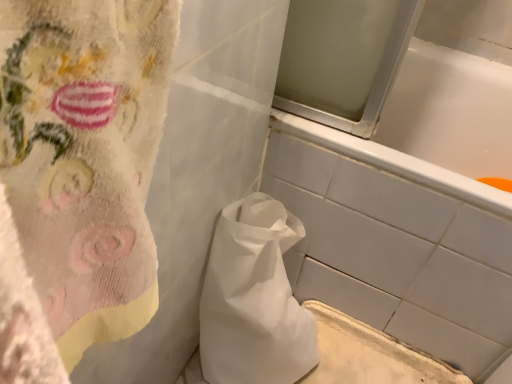
Question: Is white paper bag at center taller than white matte bathtub at center?

Choices:
 (A) yes
 (B) no

Answer: (B)

Question: Can you confirm if white paper bag at center is thinner than white matte bathtub at center?

Choices:
 (A) no
 (B) yes

Answer: (B)

Question: Would you say white matte bathtub at center is part of white paper bag at center's contents?

Choices:
 (A) yes
 (B) no

Answer: (B)

Question: Could you tell me if white paper bag at center is turned towards white matte bathtub at center?

Choices:
 (A) no
 (B) yes

Answer: (A)

Question: From a real-world perspective, is white paper bag at center positioned over white matte bathtub at center based on gravity?

Choices:
 (A) no
 (B) yes

Answer: (A)

Question: From a real-world perspective, is white paper bag at center below white matte bathtub at center?

Choices:
 (A) no
 (B) yes

Answer: (B)

Question: Would you consider white matte bathtub at center to be distant from white paper bag at center?

Choices:
 (A) yes
 (B) no

Answer: (B)

Question: Is white matte bathtub at center next to white paper bag at center and touching it?

Choices:
 (A) no
 (B) yes

Answer: (A)

Question: Can you confirm if white matte bathtub at center is taller than white paper bag at center?

Choices:
 (A) no
 (B) yes

Answer: (B)

Question: From the image's perspective, would you say white matte bathtub at center is positioned over white paper bag at center?

Choices:
 (A) no
 (B) yes

Answer: (B)

Question: Is white matte bathtub at center to the right of white paper bag at center from the viewer's perspective?

Choices:
 (A) yes
 (B) no

Answer: (A)

Question: Is white matte bathtub at center not inside white paper bag at center?

Choices:
 (A) no
 (B) yes

Answer: (B)

Question: Is white matte bathtub at center bigger or smaller than white paper bag at center?

Choices:
 (A) small
 (B) big

Answer: (B)